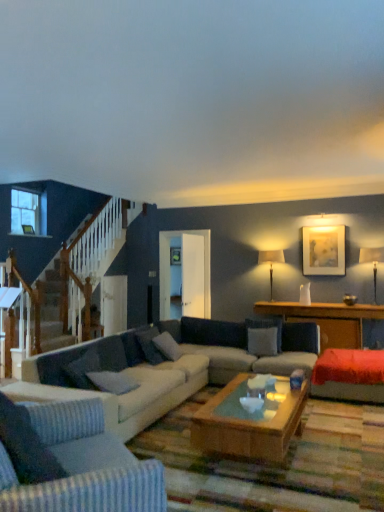
Question: From the image's perspective, is velvet red couch at right below gray fabric pillow at center, the 4th pillow when ordered from right to left?

Choices:
 (A) no
 (B) yes

Answer: (B)

Question: Can you confirm if velvet red couch at right is shorter than gray fabric pillow at center, which is counted as the fourth pillow, starting from the back?

Choices:
 (A) yes
 (B) no

Answer: (B)

Question: From a real-world perspective, is velvet red couch at right on top of gray fabric pillow at center, which appears as the 1th pillow when viewed from the front?

Choices:
 (A) yes
 (B) no

Answer: (B)

Question: Considering the relative sizes of velvet red couch at right and gray fabric pillow at center, the 1th pillow positioned from the left, in the image provided, is velvet red couch at right smaller than gray fabric pillow at center, the 1th pillow positioned from the left,?

Choices:
 (A) no
 (B) yes

Answer: (A)

Question: Can you confirm if velvet red couch at right is taller than gray fabric pillow at center, the 4th pillow when ordered from right to left?

Choices:
 (A) no
 (B) yes

Answer: (B)

Question: In terms of width, does clear glass window at upper left look wider or thinner when compared to matte white lampshade at center-right, which is counted as the first lamp, starting from the left?

Choices:
 (A) thin
 (B) wide

Answer: (A)

Question: Does point (24, 193) appear closer or farther from the camera than point (279, 258)?

Choices:
 (A) farther
 (B) closer

Answer: (B)

Question: Would you say clear glass window at upper left is inside or outside matte white lampshade at center-right, which is the first lamp from back to front?

Choices:
 (A) outside
 (B) inside

Answer: (A)

Question: From the image's perspective, relative to matte white lampshade at center-right, arranged as the second lamp when viewed from the right, is clear glass window at upper left above or below?

Choices:
 (A) above
 (B) below

Answer: (A)

Question: Considering their positions, is velvet red couch at right located in front of or behind wooden coffee table at center?

Choices:
 (A) behind
 (B) front

Answer: (B)

Question: Is velvet red couch at right wider or thinner than wooden coffee table at center?

Choices:
 (A) thin
 (B) wide

Answer: (B)

Question: Is velvet red couch at right bigger or smaller than wooden coffee table at center?

Choices:
 (A) big
 (B) small

Answer: (B)

Question: From the image's perspective, is velvet red couch at right positioned above or below wooden coffee table at center?

Choices:
 (A) above
 (B) below

Answer: (B)

Question: Is point (177, 352) positioned closer to the camera than point (364, 395)?

Choices:
 (A) farther
 (B) closer

Answer: (A)

Question: Considering the positions of gray fabric pillow at center, which appears as the 3th pillow when viewed from the left, and velvet red couch at right in the image, is gray fabric pillow at center, which appears as the 3th pillow when viewed from the left, taller or shorter than velvet red couch at right?

Choices:
 (A) short
 (B) tall

Answer: (B)